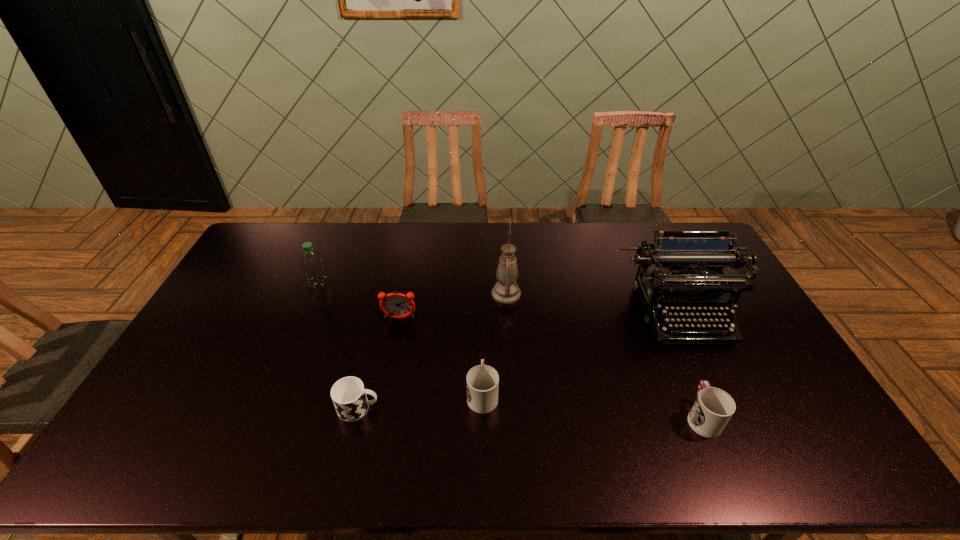
Where is `empty location between the second cup from right to left and the rightmost cup`? empty location between the second cup from right to left and the rightmost cup is located at coordinates (592, 406).

Where is `blank region between the leftmost cup and the leftmost object`? This screenshot has width=960, height=540. blank region between the leftmost cup and the leftmost object is located at coordinates (339, 346).

This screenshot has width=960, height=540. Find the location of `free spot between the second cup from left to right and the leftmost cup`. free spot between the second cup from left to right and the leftmost cup is located at coordinates (420, 401).

This screenshot has width=960, height=540. In order to click on free point between the shortest cup and the oil lamp in this screenshot , I will do `click(432, 351)`.

The width and height of the screenshot is (960, 540). I want to click on object that stands as the closest to the typewriter, so click(x=713, y=408).

Select which object appears as the sixth closest to the oil lamp. Please provide its 2D coordinates. Your answer should be formatted as a tuple, i.e. [(x, y)], where the tuple contains the x and y coordinates of a point satisfying the conditions above.

[(313, 265)]

Identify the location of cup that is the second closest to the third tallest object. (482, 380).

In order to click on cup that is the second closest one to the second cup from left to right in this screenshot , I will do tap(713, 408).

The image size is (960, 540). I want to click on vacant position in the image that satisfies the following two spatial constraints: 1. on the keyboard of the second tallest object; 2. on the side of the shortest object with the handle, so click(x=728, y=408).

Where is `vacant space that satisfies the following two spatial constraints: 1. on the handle side of the second cup from left to right; 2. on the left side of the oil lamp`? The height and width of the screenshot is (540, 960). vacant space that satisfies the following two spatial constraints: 1. on the handle side of the second cup from left to right; 2. on the left side of the oil lamp is located at coordinates (482, 293).